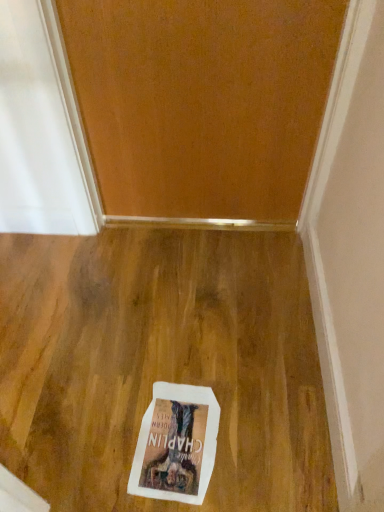
Image resolution: width=384 pixels, height=512 pixels. In order to click on free space to the back side of white paper postcard at center in this screenshot , I will do `click(162, 357)`.